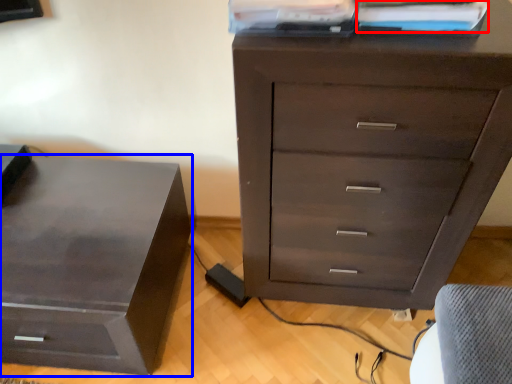
Question: Which of the following is the closest to the observer, book (highlighted by a red box) or nightstand (highlighted by a blue box)?

Choices:
 (A) book
 (B) nightstand

Answer: (A)